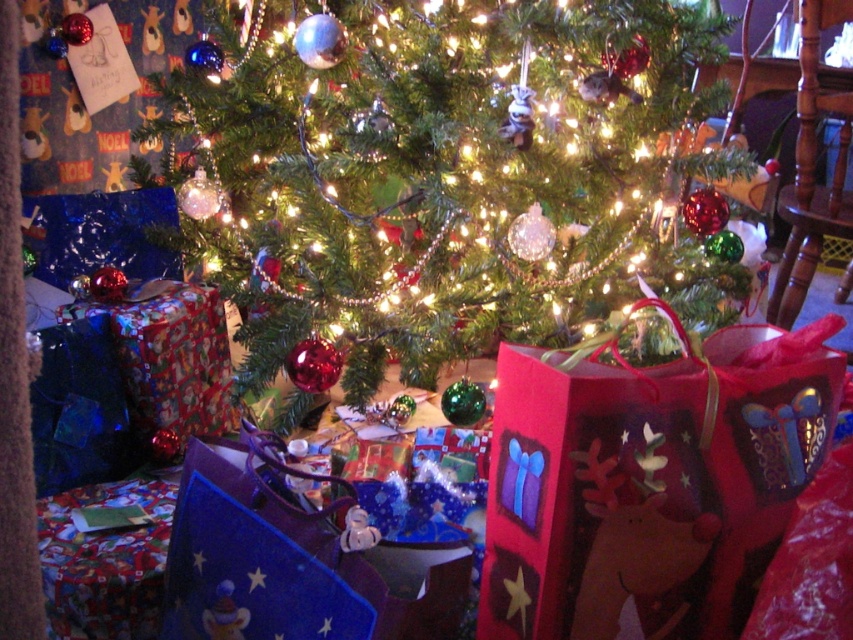
Does shiny metallic ornaments at center have a larger size compared to red paper bag with reindeer design at lower right?

Yes, shiny metallic ornaments at center is bigger than red paper bag with reindeer design at lower right.

Does shiny metallic ornaments at center appear on the left side of red paper bag with reindeer design at lower right?

Correct, you'll find shiny metallic ornaments at center to the left of red paper bag with reindeer design at lower right.

At what (x,y) coordinates should I click in order to perform the action: click on shiny metallic ornaments at center. Please return your answer as a coordinate pair (x, y). This screenshot has width=853, height=640. Looking at the image, I should click on (444, 177).